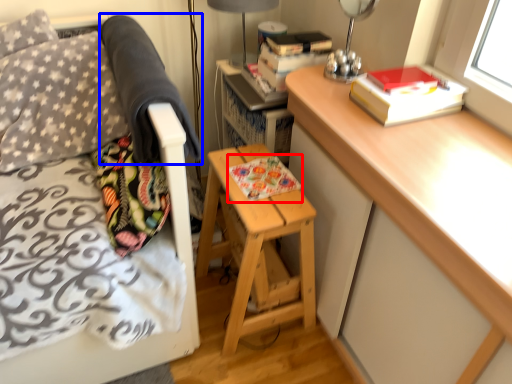
Question: Which object is further to the camera taking this photo, book (highlighted by a red box) or blanket (highlighted by a blue box)?

Choices:
 (A) book
 (B) blanket

Answer: (A)